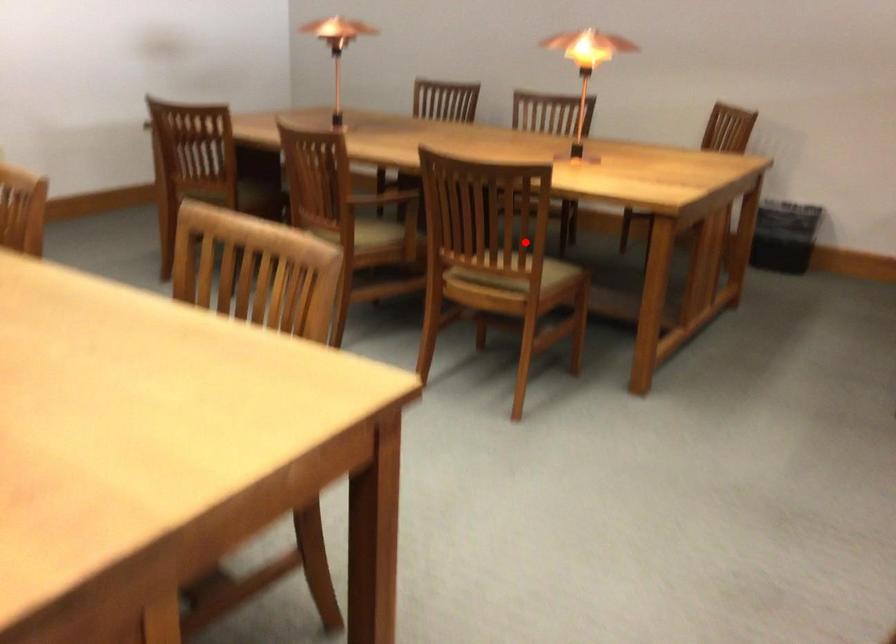
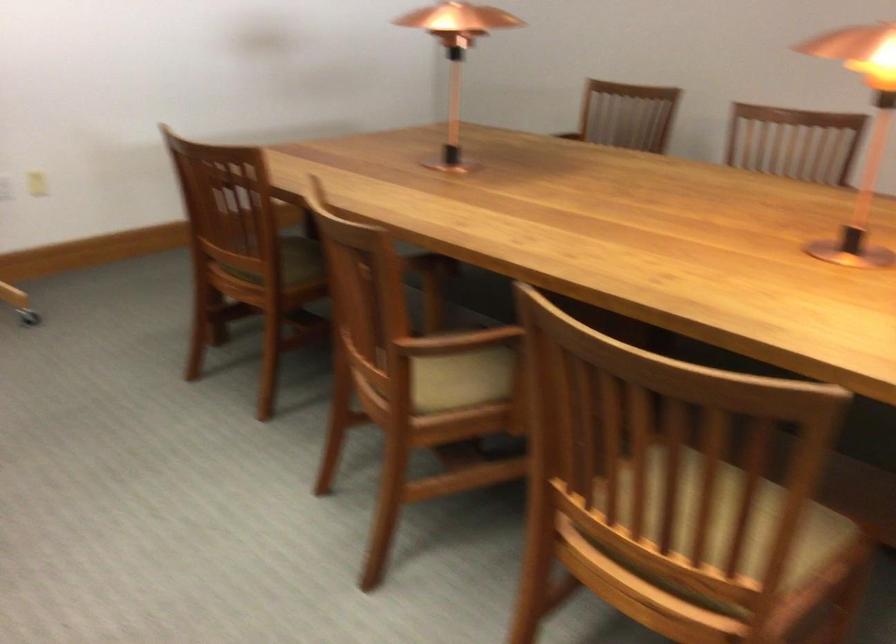
Question: I am providing you with two images of the same scene from different viewpoints. A red point is shown in image1. For the corresponding object point in image2, is it positioned nearer or farther from the camera?

Choices:
 (A) Nearer
 (B) Farther

Answer: (A)